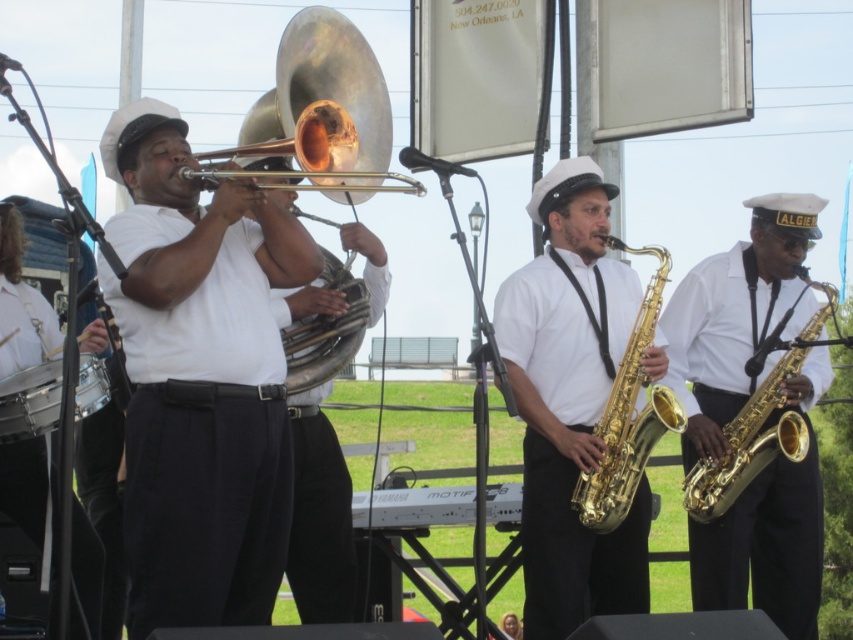
Does gold shiny trumpet at upper center appear over black drum at lower left?

Indeed, gold shiny trumpet at upper center is positioned over black drum at lower left.

What do you see at coordinates (323, 109) in the screenshot?
I see `gold shiny trumpet at upper center` at bounding box center [323, 109].

Is point (338, 147) behind point (28, 385)?

That is True.

Identify the location of gold shiny trumpet at upper center. This screenshot has width=853, height=640. (323, 109).

Which is more to the left, gold shiny saxophone at center or black drum at lower left?

From the viewer's perspective, black drum at lower left appears more on the left side.

Is point (613, 365) positioned behind point (38, 412)?

Yes, it is.

Image resolution: width=853 pixels, height=640 pixels. I want to click on gold shiny saxophone at center, so click(570, 403).

Is point (792, 428) closer to viewer compared to point (630, 248)?

No, (792, 428) is further to viewer.

Is gold shiny saxophone at right to the right of gold shiny trumpet at center from the viewer's perspective?

Yes, gold shiny saxophone at right is to the right of gold shiny trumpet at center.

At what (x,y) coordinates should I click in order to perform the action: click on gold shiny saxophone at right. Please return your answer as a coordinate pair (x, y). The width and height of the screenshot is (853, 640). Looking at the image, I should click on (759, 419).